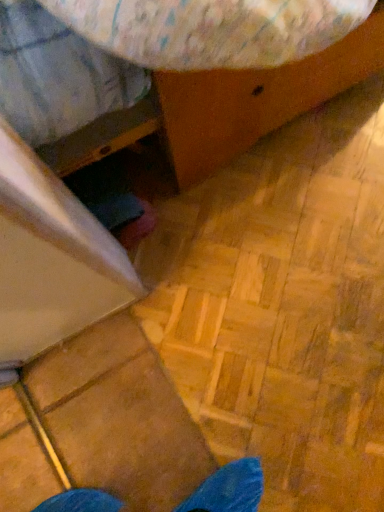
Identify the location of wooden bed at lower left. (256, 100).

What do you see at coordinates (256, 100) in the screenshot?
I see `wooden bed at lower left` at bounding box center [256, 100].

Measure the distance between point [357,50] and camera.

Point [357,50] and camera are 29.96 inches apart.

Identify the location of wooden bed at lower left. The height and width of the screenshot is (512, 384). (256, 100).